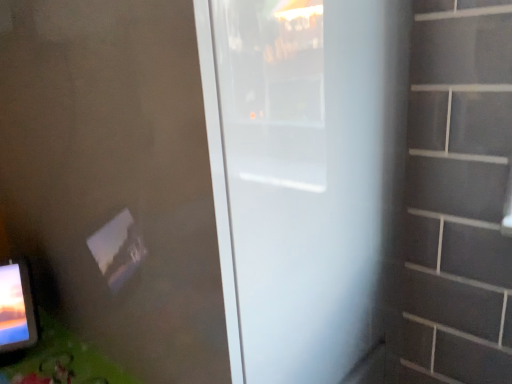
At what (x,y) coordinates should I click in order to perform the action: click on white matte door at center. Please return your answer as a coordinate pair (x, y). The height and width of the screenshot is (384, 512). Looking at the image, I should click on (305, 179).

The image size is (512, 384). Describe the element at coordinates (305, 179) in the screenshot. I see `white matte door at center` at that location.

Where is `green matte table at lower left`? green matte table at lower left is located at coordinates (59, 361).

Image resolution: width=512 pixels, height=384 pixels. What do you see at coordinates (59, 361) in the screenshot? I see `green matte table at lower left` at bounding box center [59, 361].

Identify the location of white matte door at center. The width and height of the screenshot is (512, 384). (305, 179).

Considering the relative positions of green matte table at lower left and white matte door at center in the image provided, is green matte table at lower left to the right of white matte door at center from the viewer's perspective?

In fact, green matte table at lower left is to the left of white matte door at center.

Does green matte table at lower left lie behind white matte door at center?

Yes.

Which point is more distant from viewer, (104, 363) or (257, 241)?

The point (104, 363) is behind.

Consider the image. From the image's perspective, is green matte table at lower left beneath white matte door at center?

Yes, from the image's perspective, green matte table at lower left is below white matte door at center.

From a real-world perspective, is green matte table at lower left below white matte door at center?

Yes.

Considering the sizes of objects green matte table at lower left and white matte door at center in the image provided, who is wider, green matte table at lower left or white matte door at center?

Wider between the two is white matte door at center.

From their relative heights in the image, would you say green matte table at lower left is taller or shorter than white matte door at center?

In the image, green matte table at lower left appears to be shorter than white matte door at center.

Does green matte table at lower left have a smaller size compared to white matte door at center?

Correct, green matte table at lower left occupies less space than white matte door at center.

Is white matte door at center inside green matte table at lower left?

Actually, white matte door at center is outside green matte table at lower left.

Based on the photo, is green matte table at lower left far from white matte door at center?

No, green matte table at lower left is not far away from white matte door at center.

Does green matte table at lower left turn towards white matte door at center?

No, green matte table at lower left is not aimed at white matte door at center.

Find the location of a particular element. This screenshot has height=384, width=512. door in front of the green matte table at lower left is located at coordinates (305, 179).

Which is more to the right, white matte door at center or green matte table at lower left?

white matte door at center is more to the right.

Is the position of white matte door at center less distant than that of green matte table at lower left?

Yes, it is.

Does point (359, 378) appear closer or farther from the camera than point (123, 373)?

Clearly, point (359, 378) is more distant from the camera than point (123, 373).

From the image's perspective, is white matte door at center positioned above or below green matte table at lower left?

From the image's perspective, white matte door at center appears above green matte table at lower left.

From a real-world perspective, which object rests below the other?

green matte table at lower left, from a real-world perspective.

Which of these two, white matte door at center or green matte table at lower left, is wider?

With larger width is white matte door at center.

Considering the sizes of white matte door at center and green matte table at lower left in the image, is white matte door at center taller or shorter than green matte table at lower left?

Clearly, white matte door at center is taller compared to green matte table at lower left.

In terms of size, does white matte door at center appear bigger or smaller than green matte table at lower left?

In the image, white matte door at center appears to be larger than green matte table at lower left.

Is green matte table at lower left a part of white matte door at center?

Actually, green matte table at lower left is outside white matte door at center.

Is white matte door at center not near green matte table at lower left?

That's not correct — white matte door at center is a little close to green matte table at lower left.

Could you tell me if white matte door at center is turned towards green matte table at lower left?

No, white matte door at center is not turned towards green matte table at lower left.

How different are the orientations of white matte door at center and green matte table at lower left in degrees?

The facing directions of white matte door at center and green matte table at lower left are 0.163 degrees apart.

Image resolution: width=512 pixels, height=384 pixels. Find the location of `table behind the white matte door at center`. table behind the white matte door at center is located at coordinates (59, 361).

Find the location of `table below the white matte door at center (from the image's perspective)`. table below the white matte door at center (from the image's perspective) is located at coordinates [x=59, y=361].

Where is `door located above the green matte table at lower left (from the image's perspective)`? Image resolution: width=512 pixels, height=384 pixels. door located above the green matte table at lower left (from the image's perspective) is located at coordinates (305, 179).